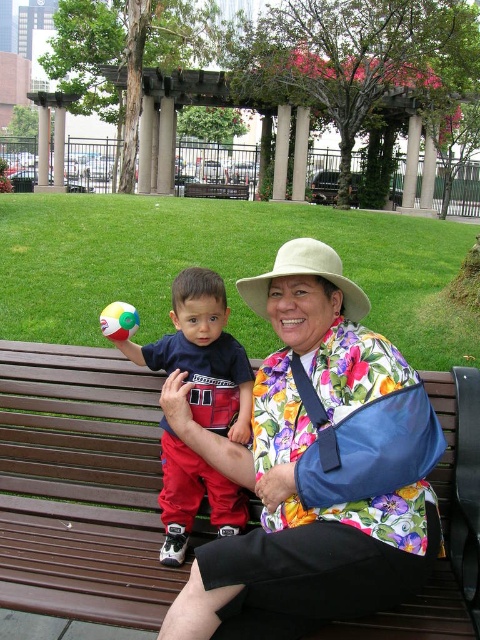
Is point (237, 426) in front of point (130, 317)?

Yes, point (237, 426) is in front of point (130, 317).

Which is in front, point (207, 406) or point (132, 314)?

Point (207, 406) is in front.

Locate an element on the screen. This screenshot has width=480, height=640. matte blue shirt at center is located at coordinates (203, 355).

Does beige fabric cowboy hat at center have a greater height compared to brown wooden bench at center?

No, beige fabric cowboy hat at center is not taller than brown wooden bench at center.

Who is shorter, beige fabric cowboy hat at center or brown wooden bench at center?

With less height is beige fabric cowboy hat at center.

Image resolution: width=480 pixels, height=640 pixels. I want to click on beige fabric cowboy hat at center, so click(x=304, y=275).

Where is `beige fabric cowboy hat at center`? This screenshot has height=640, width=480. beige fabric cowboy hat at center is located at coordinates (304, 275).

Between floral fabric shirt at center and beige fabric cowboy hat at center, which one appears on the right side from the viewer's perspective?

From the viewer's perspective, floral fabric shirt at center appears more on the right side.

How far apart are floral fabric shirt at center and beige fabric cowboy hat at center?

floral fabric shirt at center is 18.78 inches from beige fabric cowboy hat at center.

The image size is (480, 640). What are the coordinates of `floral fabric shirt at center` in the screenshot? It's located at (294, 468).

I want to click on floral fabric shirt at center, so click(294, 468).